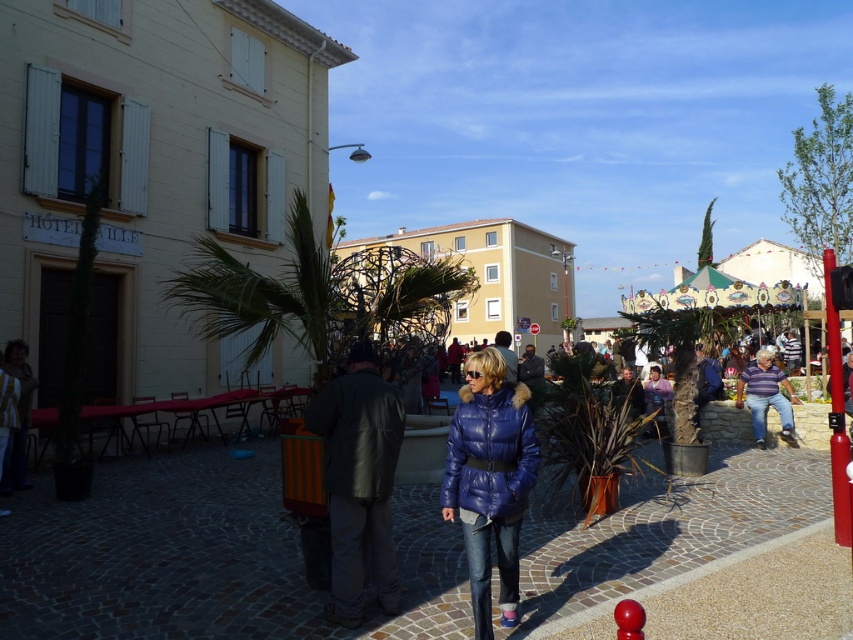
Looking at this image, you are a photographer trying to capture both the dark gray leather jacket at center and the striped cotton shirt at center in a single shot. Since you want both to be clearly visible, which clothing item should you focus on first to ensure it appears sharp in the photo?

You should focus on the dark gray leather jacket at center first because it is in front of the striped cotton shirt at center, so focusing on the closer object will keep it sharp while the background may blur slightly.

In the scene shown: You are a fashion designer observing two clothing items in the scene. The first is a dark gray leather jacket at center, and the second is a striped cotton shirt at center. Which clothing item appears taller in the image?

The dark gray leather jacket at center appears taller than the striped cotton shirt at center in the image.

You are a photographer trying to capture both the blue down jacket at center and the striped cotton shirt at center in a single frame. Since you want to ensure both are fully visible, which clothing item requires more horizontal space in your camera frame?

The striped cotton shirt at center requires more horizontal space because its width is greater than the blue down jacket at center.